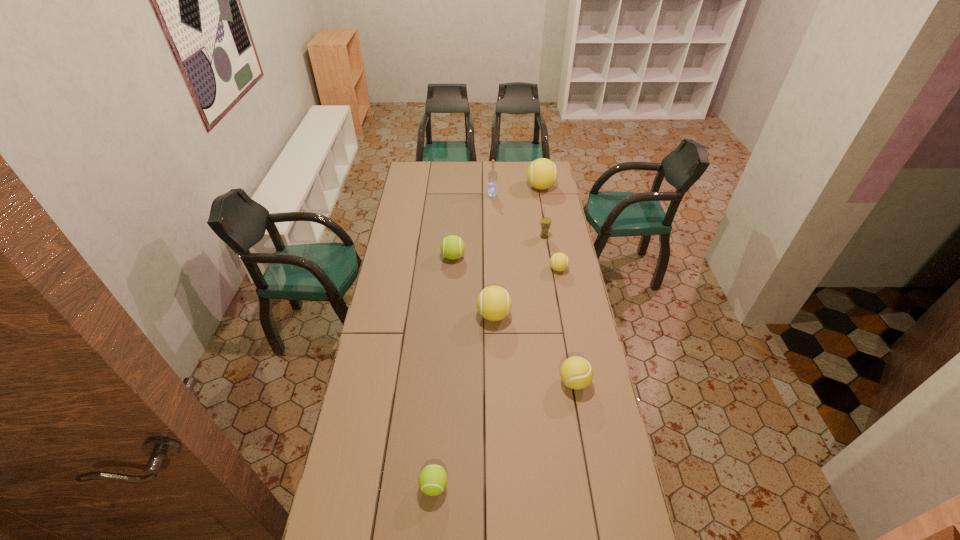
What are the coordinates of `the nearest yellow tennis ball` in the screenshot? It's located at (576, 372).

Identify the location of the nearest object. click(433, 479).

I want to click on the smaller green tennis ball, so (x=433, y=479).

Where is `the second farthest yellow tennis ball`? The image size is (960, 540). the second farthest yellow tennis ball is located at coordinates (559, 261).

Locate an element on the screen. Image resolution: width=960 pixels, height=540 pixels. vacant space situated 0.330m on the front of the vodka is located at coordinates (493, 233).

Locate an element on the screen. vacant area located 0.080m on the left of the tallest tennis ball is located at coordinates (513, 187).

Find the location of a particular element. This screenshot has width=960, height=540. free space located 0.210m on the front of the straw for drinking is located at coordinates (549, 267).

Find the location of `vacant space located 0.400m on the back of the third farthest yellow tennis ball`. vacant space located 0.400m on the back of the third farthest yellow tennis ball is located at coordinates (492, 245).

Identify the location of vacant space located 0.150m on the right of the farther green tennis ball. (495, 256).

Where is `vacant position located on the front of the second nearest object`? The width and height of the screenshot is (960, 540). vacant position located on the front of the second nearest object is located at coordinates (589, 467).